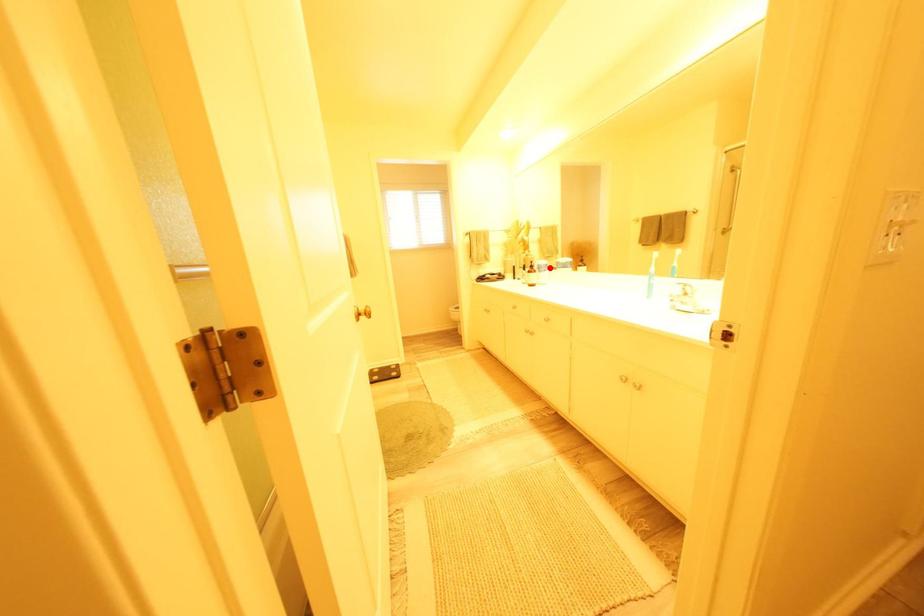
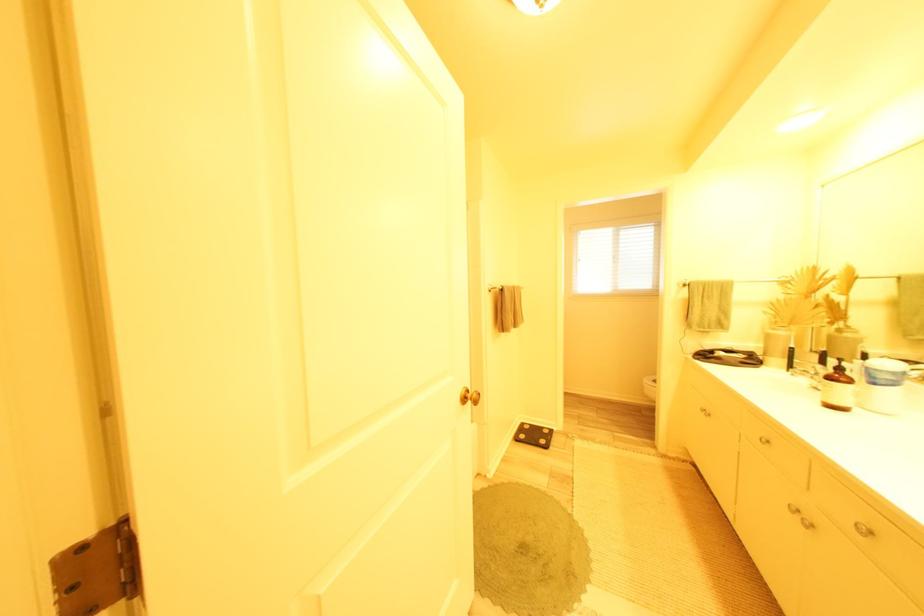
Where in the second image is the point corresponding to the highlighted location from the first image?

(881, 373)